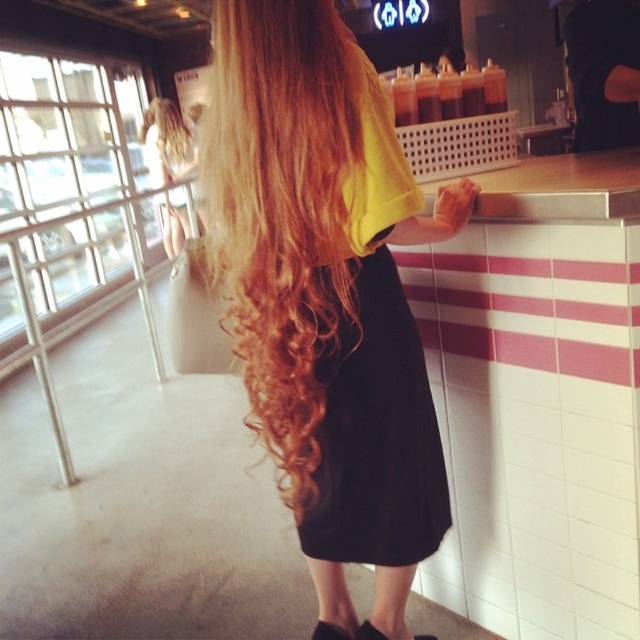
Question: Which of these objects is positioned closest to the blonde hair at center?

Choices:
 (A) blonde hair at upper left
 (B) black leather sandal at lower center

Answer: (B)

Question: Can you confirm if black leather sandal at lower center is positioned to the right of black fabric sandal at lower center?

Choices:
 (A) no
 (B) yes

Answer: (A)

Question: Among these points, which one is nearest to the camera?

Choices:
 (A) (369, 637)
 (B) (163, 196)
 (C) (326, 275)
 (D) (340, 636)

Answer: (C)

Question: Can you confirm if blonde hair at center is bigger than black leather sandal at lower center?

Choices:
 (A) no
 (B) yes

Answer: (B)

Question: Does blonde hair at center appear on the right side of blonde hair at upper left?

Choices:
 (A) no
 (B) yes

Answer: (B)

Question: Which point appears farthest from the camera in this image?

Choices:
 (A) (385, 310)
 (B) (356, 636)

Answer: (B)